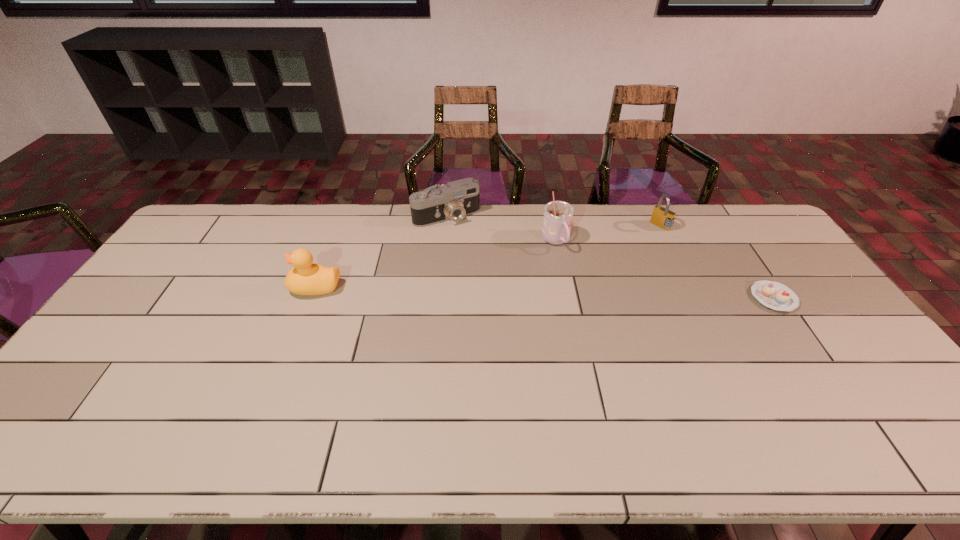
Where is `cup positioned at the far edge`? The width and height of the screenshot is (960, 540). cup positioned at the far edge is located at coordinates (558, 215).

Image resolution: width=960 pixels, height=540 pixels. Find the location of `camera at the far edge`. camera at the far edge is located at coordinates point(455,200).

Find the location of a particular element. The height and width of the screenshot is (540, 960). object situated at the right edge is located at coordinates (774, 295).

You are a GUI agent. You are given a task and a screenshot of the screen. Output one action in this format:
    pyautogui.click(x=<x>, y=<y>)
    Task: Click on the blank space at the far edge of the desktop
    This screenshot has width=960, height=540.
    Given the screenshot: What is the action you would take?
    pyautogui.click(x=593, y=237)

Find the location of a particular element. The width and height of the screenshot is (960, 540). free space at the near edge of the desktop is located at coordinates (461, 403).

The width and height of the screenshot is (960, 540). I want to click on free space at the left edge of the desktop, so click(188, 254).

Find the location of a particular element. blank area at the right edge is located at coordinates (827, 338).

This screenshot has width=960, height=540. What are the coordinates of `empty space that is in between the second object from right to left and the cupcake` in the screenshot? It's located at (717, 262).

Image resolution: width=960 pixels, height=540 pixels. I want to click on free space that is in between the rightmost object and the third object from left to right, so click(664, 269).

At what (x,y) coordinates should I click in order to perform the action: click on empty space between the cupcake and the leftmost object. Please return your answer as a coordinate pair (x, y). Looking at the image, I should click on click(x=544, y=292).